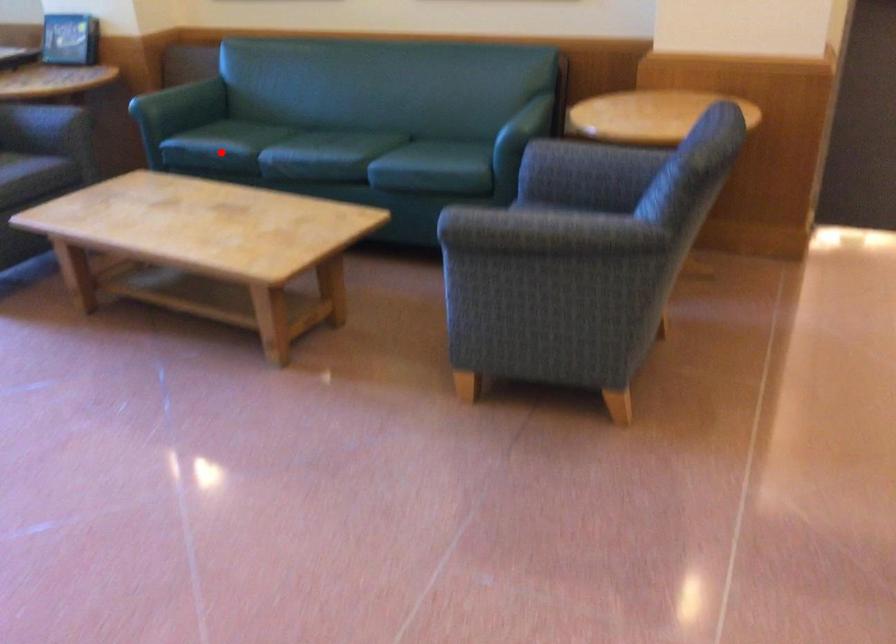
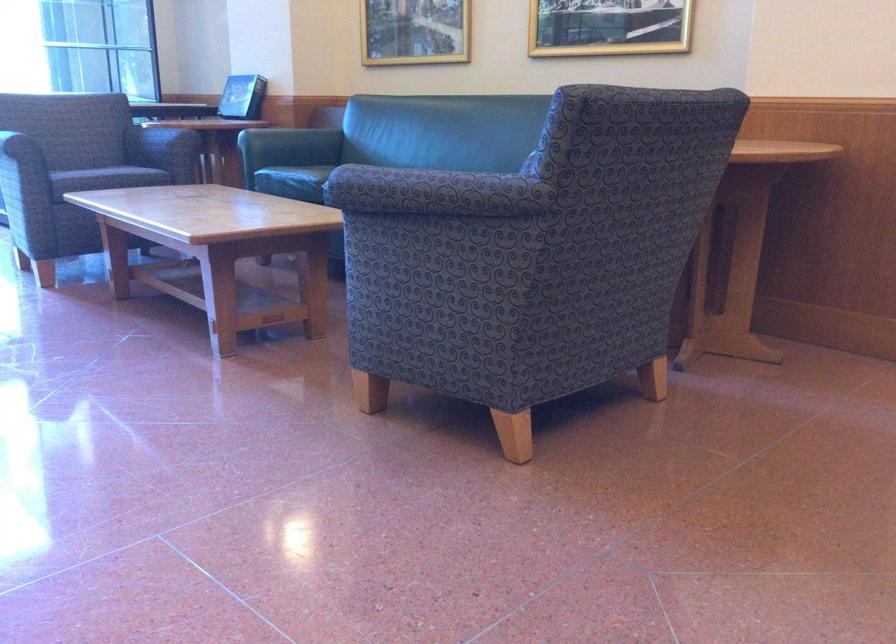
Where in the second image is the point corresponding to the highlighted location from the first image?

(293, 182)